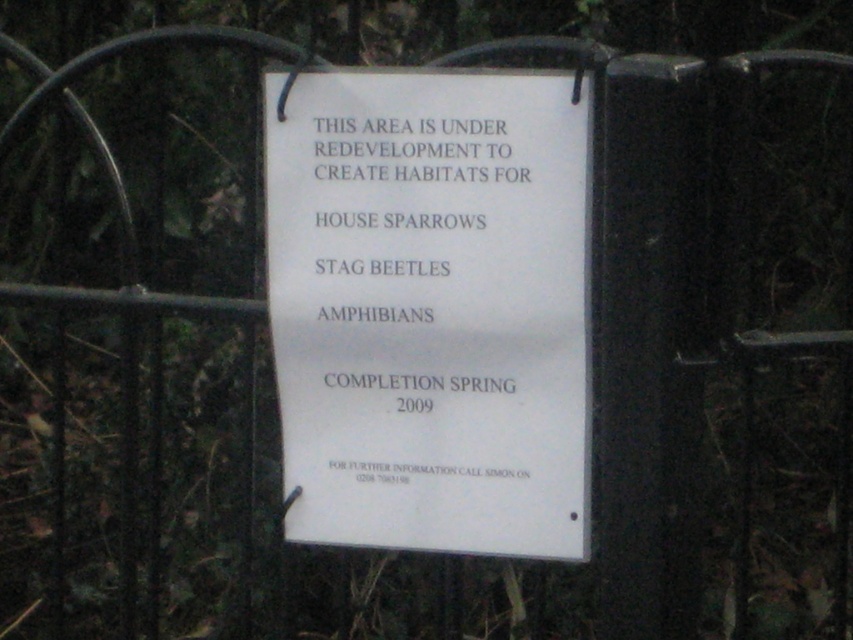
Question: Can you confirm if white paper sign at center is positioned to the right of white paper at center?

Choices:
 (A) no
 (B) yes

Answer: (B)

Question: Is white paper sign at center to the right of white paper at center from the viewer's perspective?

Choices:
 (A) no
 (B) yes

Answer: (B)

Question: Which object is farther from the camera taking this photo?

Choices:
 (A) white paper at center
 (B) white paper sign at center

Answer: (A)

Question: Does white paper sign at center appear on the left side of white paper at center?

Choices:
 (A) no
 (B) yes

Answer: (A)

Question: Among these points, which one is farthest from the camera?

Choices:
 (A) (491, 493)
 (B) (410, 202)

Answer: (A)

Question: Which point is closer to the camera taking this photo?

Choices:
 (A) (403, 336)
 (B) (372, 365)

Answer: (A)